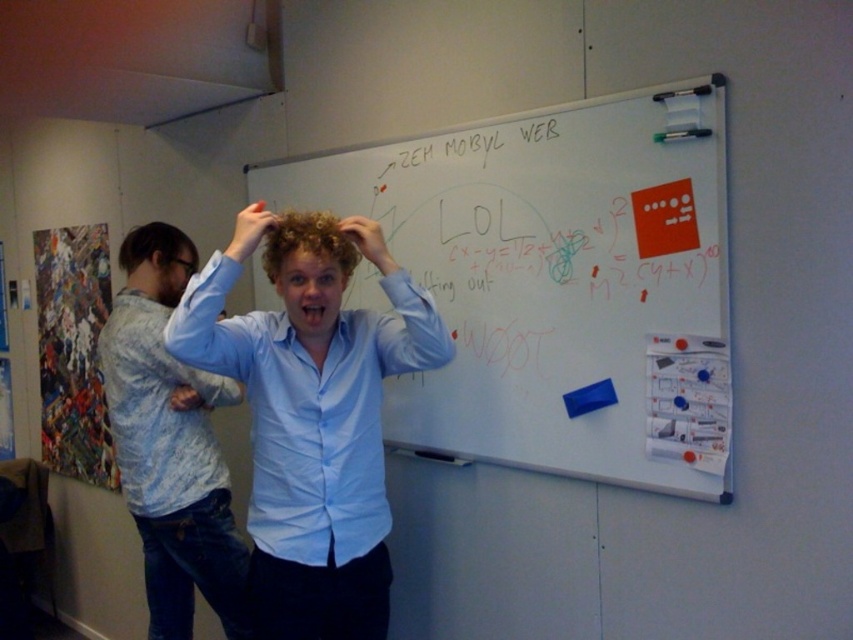
How distant is curly blonde hair at center from curly hair at center?

A distance of 4.11 inches exists between curly blonde hair at center and curly hair at center.

What do you see at coordinates (309, 269) in the screenshot? I see `curly blonde hair at center` at bounding box center [309, 269].

Find the location of a particular element. This screenshot has width=853, height=640. curly blonde hair at center is located at coordinates (309, 269).

Is point (419, 346) positioned before point (242, 259)?

No, it is behind (242, 259).

Locate an element on the screen. The image size is (853, 640). light blue shirt at center is located at coordinates (312, 422).

Does point (207, 289) come farther from viewer compared to point (250, 230)?

No, (207, 289) is closer to viewer.

At what (x,y) coordinates should I click in order to perform the action: click on light blue shirt at center. Please return your answer as a coordinate pair (x, y). The image size is (853, 640). Looking at the image, I should click on (312, 422).

What do you see at coordinates (170, 444) in the screenshot? The width and height of the screenshot is (853, 640). I see `blue cotton shirt at center` at bounding box center [170, 444].

Does blue cotton shirt at center come behind curly hair at center?

Yes, it is behind curly hair at center.

Who is more forward, (221, 477) or (358, 218)?

Point (358, 218) is more forward.

Locate an element on the screen. This screenshot has height=640, width=853. blue cotton shirt at center is located at coordinates (170, 444).